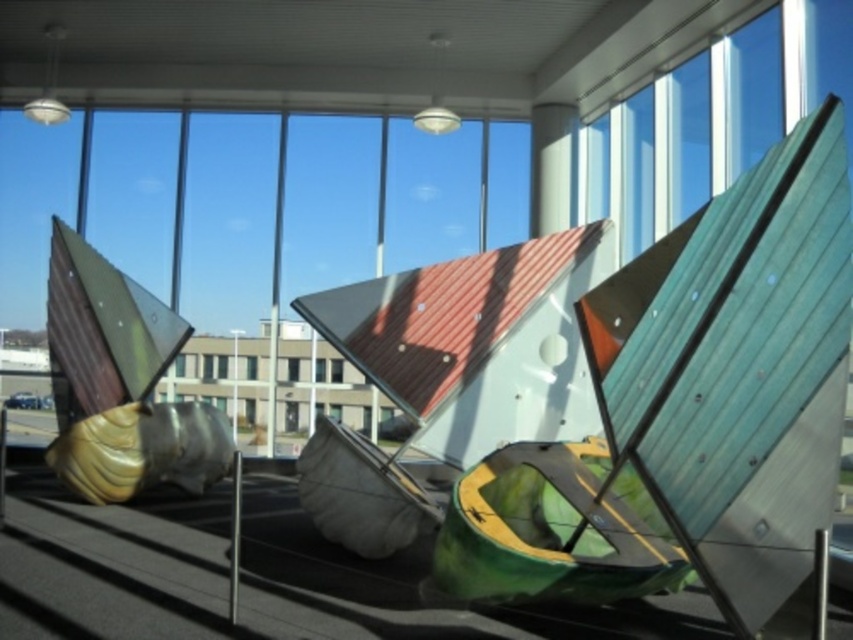
You are standing in the center of the room facing the large windows. There is a gold metallic sculpture at left. Where is the gold metallic sculpture located relative to your position?

The gold metallic sculpture at left is located at point 0.600 on the horizontal axis and 0.142 on the vertical axis relative to your position.

You are an interior designer planning to place a new sofa in this room. The sofa will be positioned so that it faces the transparent glass window at center. However, you want to ensure that the sofa won not block the view of the gold metallic sculpture at left from the window. Given their sizes, is this arrangement possible?

The gold metallic sculpture at left is much taller than the transparent glass window at center. Since the sculpture is taller, positioning the sofa facing the window might block the lower part of the sculpture, but the upper part of the sculpture would still be visible above the sofa. Therefore, the arrangement is possible as the sculpture extends beyond the window height.